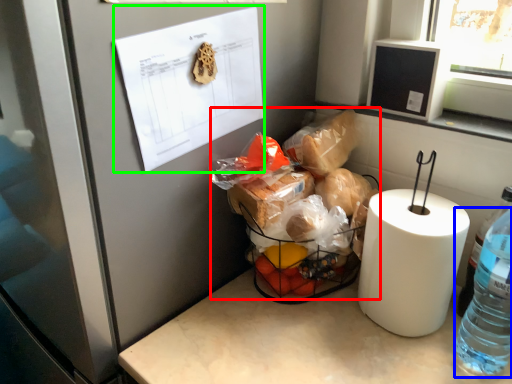
Question: Which object is the farthest from waste (highlighted by a red box)? Choose among these: bottle (highlighted by a blue box) or paper (highlighted by a green box).

Choices:
 (A) bottle
 (B) paper

Answer: (A)